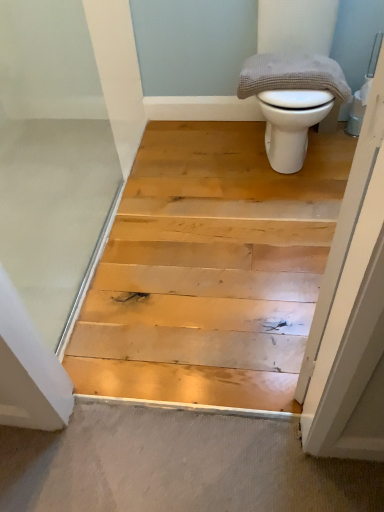
Question: From a real-world perspective, is gray textured towel at upper right physically below white glossy toilet at upper right?

Choices:
 (A) yes
 (B) no

Answer: (B)

Question: Are gray textured towel at upper right and white glossy toilet at upper right making contact?

Choices:
 (A) yes
 (B) no

Answer: (A)

Question: Considering the relative positions of gray textured towel at upper right and white glossy toilet at upper right in the image provided, is gray textured towel at upper right to the right of white glossy toilet at upper right from the viewer's perspective?

Choices:
 (A) yes
 (B) no

Answer: (B)

Question: From a real-world perspective, is gray textured towel at upper right on top of white glossy toilet at upper right?

Choices:
 (A) no
 (B) yes

Answer: (B)

Question: Does gray textured towel at upper right have a smaller size compared to white glossy toilet at upper right?

Choices:
 (A) no
 (B) yes

Answer: (B)

Question: Is gray textured towel at upper right at the left side of white glossy toilet at upper right?

Choices:
 (A) yes
 (B) no

Answer: (A)

Question: Is white glossy toilet at upper right with gray textured towel at upper right?

Choices:
 (A) yes
 (B) no

Answer: (A)

Question: Is white glossy toilet at upper right bigger than gray textured towel at upper right?

Choices:
 (A) yes
 (B) no

Answer: (A)

Question: From a real-world perspective, is white glossy toilet at upper right located beneath gray textured towel at upper right?

Choices:
 (A) yes
 (B) no

Answer: (A)

Question: Is gray textured towel at upper right surrounded by white glossy toilet at upper right?

Choices:
 (A) no
 (B) yes

Answer: (B)

Question: Could you tell me if white glossy toilet at upper right is facing gray textured towel at upper right?

Choices:
 (A) yes
 (B) no

Answer: (A)

Question: Is white glossy toilet at upper right shorter than gray textured towel at upper right?

Choices:
 (A) no
 (B) yes

Answer: (A)

Question: Is gray textured towel at upper right situated inside white glossy toilet at upper right or outside?

Choices:
 (A) outside
 (B) inside

Answer: (B)